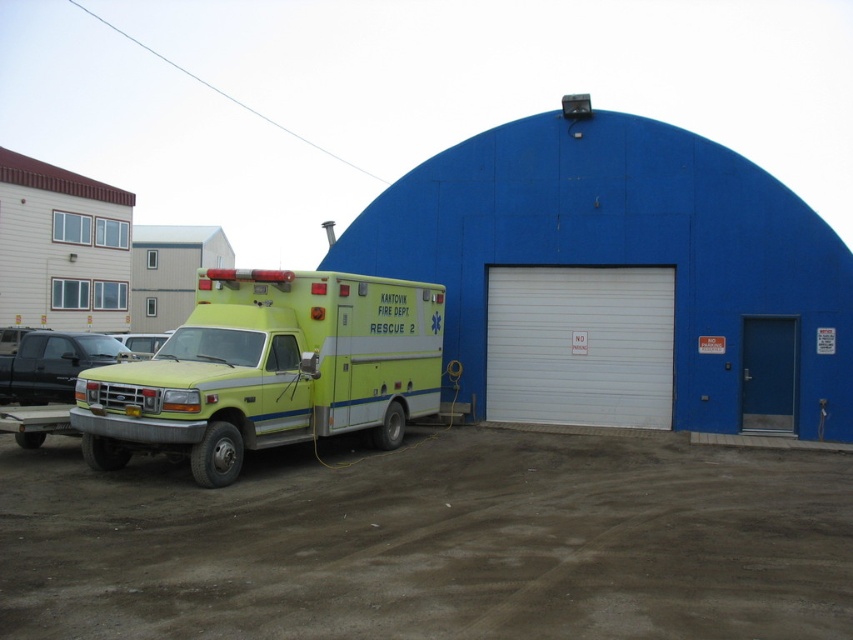
Is yellow matte ambulance at center positioned in front of blue matte door at right?

Yes, yellow matte ambulance at center is in front of blue matte door at right.

Is point (370, 305) farther from viewer compared to point (779, 401)?

That is False.

Between point (207, 321) and point (790, 394), which one is positioned behind?

The point (790, 394) is more distant.

I want to click on yellow matte ambulance at center, so click(x=270, y=371).

What do you see at coordinates (579, 346) in the screenshot?
I see `white smooth garage door at center` at bounding box center [579, 346].

Is point (508, 401) positioned before point (761, 385)?

No, (508, 401) is further to viewer.

Find the location of a particular element. Image resolution: width=853 pixels, height=640 pixels. white smooth garage door at center is located at coordinates (579, 346).

Which is behind, point (215, 426) or point (502, 388)?

The point (502, 388) is more distant.

Can you confirm if yellow matte ambulance at center is positioned to the right of white smooth garage door at center?

Incorrect, yellow matte ambulance at center is not on the right side of white smooth garage door at center.

Is point (412, 381) positioned in front of point (579, 401)?

Yes.

Locate an element on the screen. yellow matte ambulance at center is located at coordinates (270, 371).